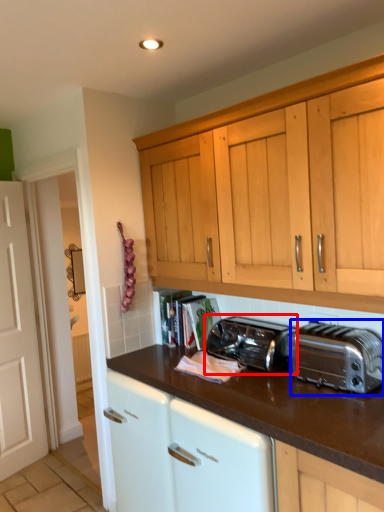
Question: Which of the following is the farthest to the observer, toaster (highlighted by a red box) or toaster (highlighted by a blue box)?

Choices:
 (A) toaster
 (B) toaster

Answer: (A)